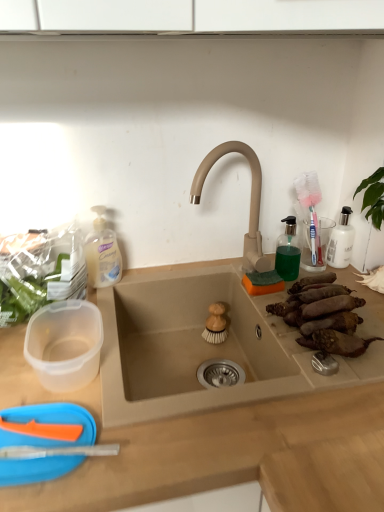
Question: Are beige matte sink at center and brown rough sweet potatoes at right sink, the first food from the right, far apart?

Choices:
 (A) yes
 (B) no

Answer: (B)

Question: Does beige matte sink at center have a larger size compared to brown rough sweet potatoes at right sink, the first food from the right?

Choices:
 (A) no
 (B) yes

Answer: (B)

Question: Does beige matte sink at center have a greater height compared to brown rough sweet potatoes at right sink, the first food from the right?

Choices:
 (A) yes
 (B) no

Answer: (A)

Question: Is beige matte sink at center aimed at brown rough sweet potatoes at right sink, the first food from the right?

Choices:
 (A) no
 (B) yes

Answer: (A)

Question: Can you confirm if beige matte sink at center is thinner than brown rough sweet potatoes at right sink, arranged as the first food when viewed from the front?

Choices:
 (A) no
 (B) yes

Answer: (A)

Question: Does beige matte sink at center have a smaller size compared to brown rough sweet potatoes at right sink, arranged as the first food when viewed from the front?

Choices:
 (A) no
 (B) yes

Answer: (A)

Question: Considering the relative sizes of brown rough sweet potatoes at right sink, arranged as the first food when viewed from the front, and transparent plastic soap dispenser at upper right in the image provided, is brown rough sweet potatoes at right sink, arranged as the first food when viewed from the front, smaller than transparent plastic soap dispenser at upper right?

Choices:
 (A) yes
 (B) no

Answer: (B)

Question: Is brown rough sweet potatoes at right sink, the first food from the right, shorter than transparent plastic soap dispenser at upper right?

Choices:
 (A) no
 (B) yes

Answer: (B)

Question: From the image's perspective, is brown rough sweet potatoes at right sink, acting as the second food starting from the left, above transparent plastic soap dispenser at upper right?

Choices:
 (A) no
 (B) yes

Answer: (A)

Question: Would you consider brown rough sweet potatoes at right sink, arranged as the first food when viewed from the front, to be distant from transparent plastic soap dispenser at upper right?

Choices:
 (A) yes
 (B) no

Answer: (B)

Question: Does brown rough sweet potatoes at right sink, the 2th food positioned from the back, have a larger size compared to transparent plastic soap dispenser at upper right?

Choices:
 (A) yes
 (B) no

Answer: (A)

Question: Can you confirm if brown rough sweet potatoes at right sink, arranged as the first food when viewed from the front, is taller than transparent plastic soap dispenser at upper right?

Choices:
 (A) no
 (B) yes

Answer: (A)

Question: Can you confirm if beige matte faucet at center is shorter than beige matte sink at center?

Choices:
 (A) no
 (B) yes

Answer: (A)